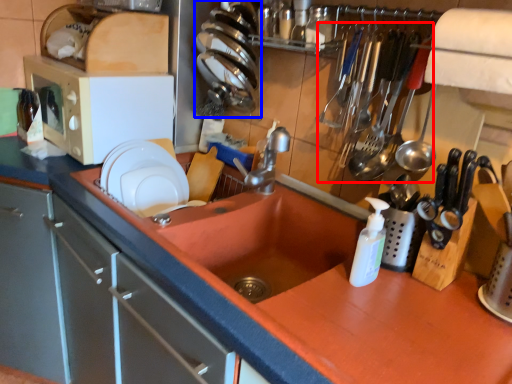
Question: Which object is closer to the camera taking this photo, silverware (highlighted by a red box) or tableware (highlighted by a blue box)?

Choices:
 (A) silverware
 (B) tableware

Answer: (A)